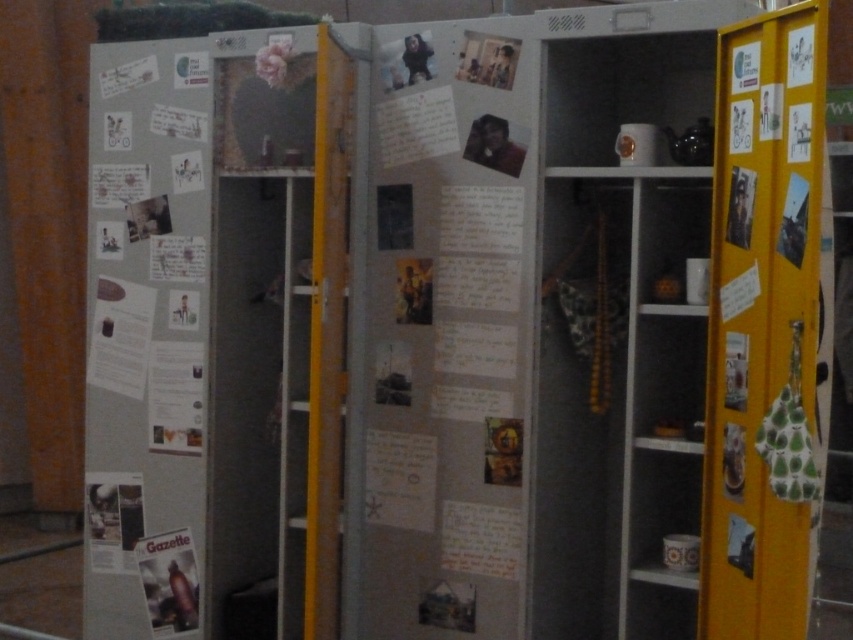
Question: Which object is positioned farthest from the yellow matte bulletin board at right?

Choices:
 (A) matte paper poster at center
 (B) matte paper gazette at lower left

Answer: (B)

Question: Can you confirm if matte paper poster at left is positioned above matte paper gazette at lower left?

Choices:
 (A) no
 (B) yes

Answer: (B)

Question: Does matte paper poster at center have a greater width compared to matte paper poster at left?

Choices:
 (A) no
 (B) yes

Answer: (B)

Question: Which of the following is the farthest from the observer?

Choices:
 (A) (84, 627)
 (B) (735, 28)
 (C) (167, 576)
 (D) (479, 346)

Answer: (A)

Question: Does matte paper poster at left have a lesser width compared to yellow matte bulletin board at right?

Choices:
 (A) yes
 (B) no

Answer: (B)

Question: Which point appears farthest from the camera in this image?

Choices:
 (A) (200, 200)
 (B) (798, 60)

Answer: (A)